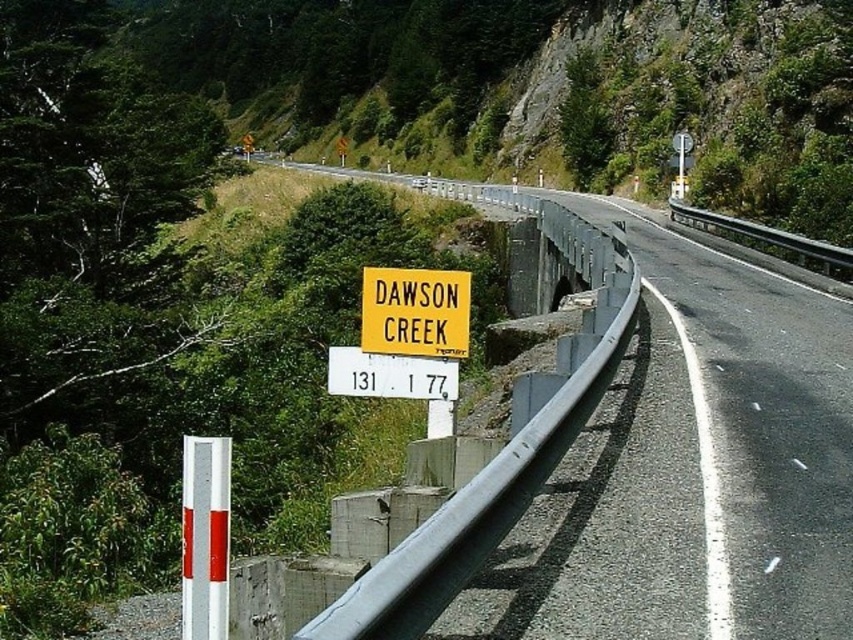
Is yellow plastic sign at center taller than yellow matte sign at center?

Correct, yellow plastic sign at center is much taller as yellow matte sign at center.

Locate an element on the screen. This screenshot has height=640, width=853. yellow plastic sign at center is located at coordinates (691, 468).

At what (x,y) coordinates should I click in order to perform the action: click on yellow plastic sign at center. Please return your answer as a coordinate pair (x, y). The height and width of the screenshot is (640, 853). Looking at the image, I should click on (691, 468).